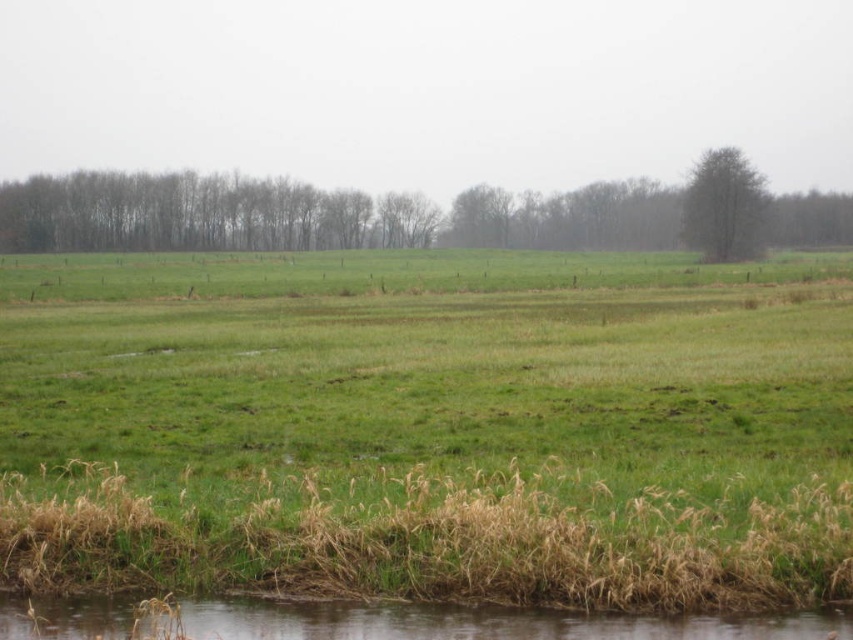
You are standing at the bottom edge of the image where the small body of water is. Which direction should you walk to reach the green grassy river at lower center?

The green grassy river at lower center is located at point (480, 621), so you should walk towards the center of the image to reach it.

You are a hiker planning to cross the green grassy river at lower center to reach the green leafy tree at center. Given that the distance between them is 146.20 meters, can you estimate how long it would take you to walk there at a normal pace?

The distance between the green grassy river at lower center and the green leafy tree at center is 146.20 meters. At a normal walking pace of approximately 1.4 meters per second, it would take roughly 104.4 seconds, which is about 1 minute and 44 seconds, to reach the green leafy tree at center from the green grassy river at lower center.

You are a hiker carrying a heavy backpack and need to reach the green leafy tree at upper right from your current position near the green grassy river at lower center. Considering the terrain described in the scene, can you estimate how long it would take you to walk there at a moderate pace?

The distance between the green grassy river at lower center and the green leafy tree at upper right is 132.09 meters. At a moderate walking pace of approximately 5 km per hour, it would take roughly 3 minutes to cover this distance.